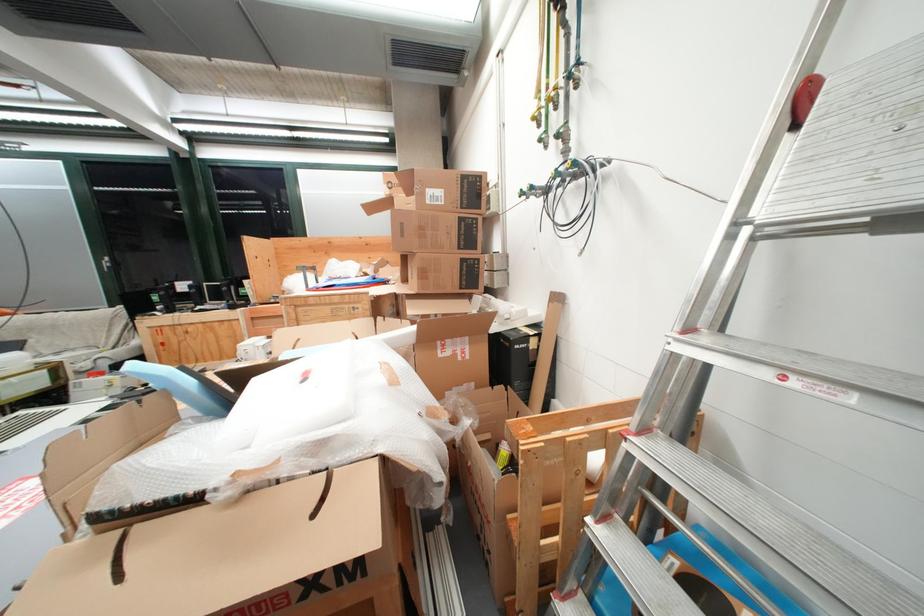
Image resolution: width=924 pixels, height=616 pixels. Describe the element at coordinates (322, 495) in the screenshot. I see `the cardboard box handle` at that location.